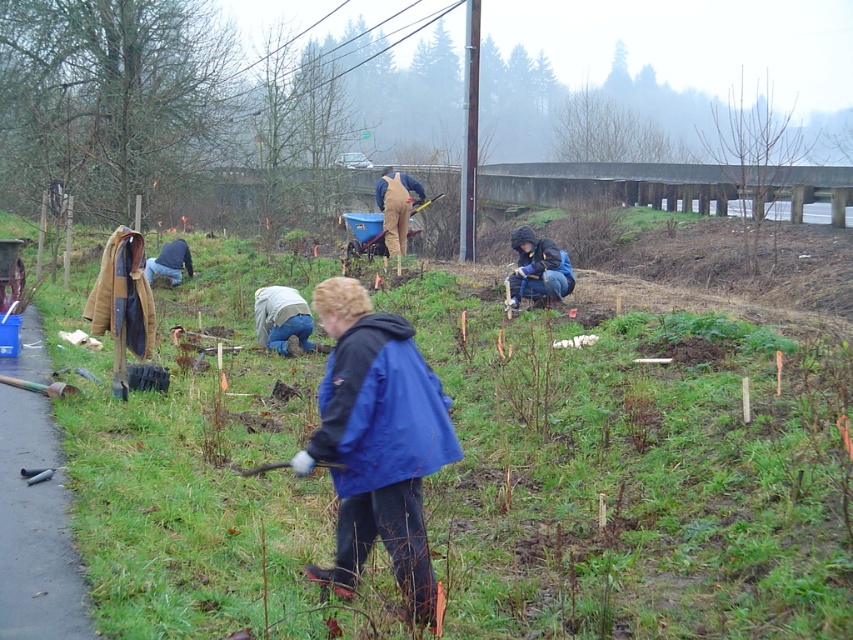
You are standing at the point labeled point (578, 561) and want to walk to the point labeled point (529, 237). Which direction should you face to move towards your destination?

You should face away from the viewer because point (529, 237) is further away from the viewer compared to point (578, 561).

Based on the scene description, can you determine which object, the green grass at center or the dark blue jacket at center, occupies more space in the image?

The green grass at center has a larger size compared to the dark blue jacket at center, so it occupies more space in the image.